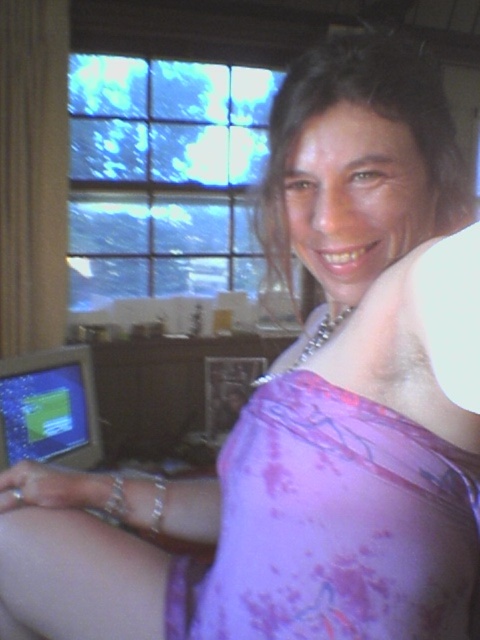
Question: Does purple satin dress at center appear on the right side of matte plastic monitor at lower left?

Choices:
 (A) yes
 (B) no

Answer: (A)

Question: Which point is farther to the camera?

Choices:
 (A) matte plastic monitor at lower left
 (B) purple satin dress at center

Answer: (A)

Question: Which point appears closest to the camera in this image?

Choices:
 (A) (472, 554)
 (B) (45, 381)

Answer: (A)

Question: Is purple satin dress at center to the left of matte plastic monitor at lower left from the viewer's perspective?

Choices:
 (A) yes
 (B) no

Answer: (B)

Question: Does purple satin dress at center have a smaller size compared to matte plastic monitor at lower left?

Choices:
 (A) no
 (B) yes

Answer: (A)